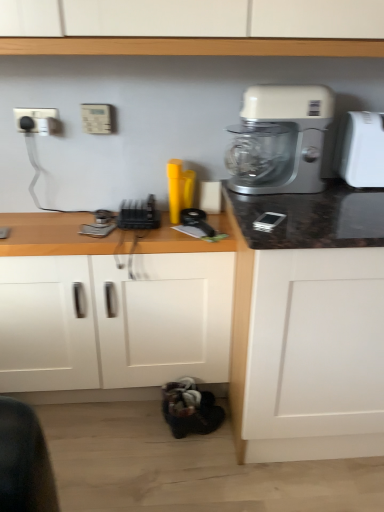
What is the approximate height of black plastic toaster at center?

1.46 inches.

What do you see at coordinates (37, 120) in the screenshot?
I see `white plastic electric outlet at upper left, the 1th electric outlet when ordered from left to right` at bounding box center [37, 120].

What do you see at coordinates (361, 149) in the screenshot? I see `white plastic toaster at right` at bounding box center [361, 149].

Find the location of a particular element. The image size is (384, 512). black plastic toaster at center is located at coordinates (139, 214).

Is white plastic mixer at upper right turned away from white plastic electric outlet at upper left, the 1th electric outlet when ordered from left to right?

No, white plastic mixer at upper right is not facing away from white plastic electric outlet at upper left, the 1th electric outlet when ordered from left to right.

Locate an element on the screen. mixer on the right side of white plastic electric outlet at upper left, positioned as the 2th electric outlet in right-to-left order is located at coordinates (280, 140).

Which object is wider, white plastic mixer at upper right or white plastic electric outlet at upper left, positioned as the 2th electric outlet in right-to-left order?

Wider between the two is white plastic mixer at upper right.

Is white plastic mixer at upper right shorter than white plastic electric outlet at upper left, the 1th electric outlet when ordered from left to right?

No.

From a real-world perspective, is wooden at lower left located beneath black plastic toaster at center?

Yes, from a real-world perspective, wooden at lower left is beneath black plastic toaster at center.

Which object is thinner, wooden at lower left or black plastic toaster at center?

black plastic toaster at center is thinner.

Is wooden at lower left not close to black plastic toaster at center?

Actually, wooden at lower left and black plastic toaster at center are a little close together.

Between wooden at lower left and black plastic toaster at center, which one appears on the right side from the viewer's perspective?

black plastic toaster at center.

Between beige plastic electric outlet at upper center, which is counted as the second electric outlet, starting from the left, and white plastic electric outlet at upper left, the 1th electric outlet when ordered from left to right, which one has less height?

white plastic electric outlet at upper left, the 1th electric outlet when ordered from left to right.

Considering the sizes of objects beige plastic electric outlet at upper center, the first electric outlet when ordered from right to left, and white plastic electric outlet at upper left, positioned as the 2th electric outlet in right-to-left order, in the image provided, who is smaller, beige plastic electric outlet at upper center, the first electric outlet when ordered from right to left, or white plastic electric outlet at upper left, positioned as the 2th electric outlet in right-to-left order,?

Smaller between the two is white plastic electric outlet at upper left, positioned as the 2th electric outlet in right-to-left order.

Considering their positions, is beige plastic electric outlet at upper center, the first electric outlet when ordered from right to left, located in front of or behind white plastic electric outlet at upper left, positioned as the 2th electric outlet in right-to-left order?

In the image, beige plastic electric outlet at upper center, the first electric outlet when ordered from right to left, appears in front of white plastic electric outlet at upper left, positioned as the 2th electric outlet in right-to-left order.

How many degrees apart are the facing directions of beige plastic electric outlet at upper center, which is counted as the second electric outlet, starting from the left, and white plastic electric outlet at upper left, positioned as the 2th electric outlet in right-to-left order?

They differ by 2.73 degrees in their facing directions.

Is white plastic toaster at right aimed at white plastic mixer at upper right?

No.

Where is `toaster that appears behind the white plastic mixer at upper right`? The height and width of the screenshot is (512, 384). toaster that appears behind the white plastic mixer at upper right is located at coordinates (361, 149).

From a real-world perspective, is white plastic toaster at right above or below white plastic mixer at upper right?

From a real-world perspective, white plastic toaster at right is physically below white plastic mixer at upper right.

How many degrees apart are the facing directions of beige plastic electric outlet at upper center, which is counted as the second electric outlet, starting from the left, and black plastic toaster at center?

They differ by 1.11 degrees in their facing directions.

Is black plastic toaster at center at the back of beige plastic electric outlet at upper center, which is counted as the second electric outlet, starting from the left?

No, beige plastic electric outlet at upper center, which is counted as the second electric outlet, starting from the left, is not facing away from black plastic toaster at center.

Where is `appliance in front of the beige plastic electric outlet at upper center, the first electric outlet when ordered from right to left`? Image resolution: width=384 pixels, height=512 pixels. appliance in front of the beige plastic electric outlet at upper center, the first electric outlet when ordered from right to left is located at coordinates (139, 214).

Is black plastic toaster at center located within beige plastic electric outlet at upper center, the first electric outlet when ordered from right to left?

No, black plastic toaster at center is not a part of beige plastic electric outlet at upper center, the first electric outlet when ordered from right to left.

Considering the positions of objects white plastic toaster at right and white plastic electric outlet at upper left, the 1th electric outlet when ordered from left to right, in the image provided, who is behind, white plastic toaster at right or white plastic electric outlet at upper left, the 1th electric outlet when ordered from left to right,?

white plastic electric outlet at upper left, the 1th electric outlet when ordered from left to right, is further from the camera.

Where is `toaster in front of the white plastic electric outlet at upper left, the 1th electric outlet when ordered from left to right`? The width and height of the screenshot is (384, 512). toaster in front of the white plastic electric outlet at upper left, the 1th electric outlet when ordered from left to right is located at coordinates (361, 149).

Is white plastic toaster at right not inside white plastic electric outlet at upper left, positioned as the 2th electric outlet in right-to-left order?

white plastic toaster at right is positioned outside white plastic electric outlet at upper left, positioned as the 2th electric outlet in right-to-left order.

In the scene shown: Is white plastic mixer at upper right positioned beyond the bounds of beige plastic electric outlet at upper center, which is counted as the second electric outlet, starting from the left?

That's correct, white plastic mixer at upper right is outside of beige plastic electric outlet at upper center, which is counted as the second electric outlet, starting from the left.

Is beige plastic electric outlet at upper center, which is counted as the second electric outlet, starting from the left, at the back of white plastic mixer at upper right?

No, beige plastic electric outlet at upper center, which is counted as the second electric outlet, starting from the left, is not at the back of white plastic mixer at upper right.

Considering the sizes of objects white plastic mixer at upper right and beige plastic electric outlet at upper center, which is counted as the second electric outlet, starting from the left, in the image provided, who is bigger, white plastic mixer at upper right or beige plastic electric outlet at upper center, which is counted as the second electric outlet, starting from the left,?

white plastic mixer at upper right.

From the image's perspective, would you say white plastic mixer at upper right is shown under beige plastic electric outlet at upper center, the first electric outlet when ordered from right to left?

Yes.

This screenshot has height=512, width=384. I want to click on the 2nd electric outlet above when counting from the white plastic mixer at upper right (from the image's perspective), so coord(37,120).

I want to click on counter in front of the black plastic toaster at center, so click(x=116, y=320).

Estimate the real-world distances between objects in this image. Which object is closer to white plastic mixer at upper right, white plastic electric outlet at upper left, the 1th electric outlet when ordered from left to right, or wooden at lower left?

wooden at lower left lies closer to white plastic mixer at upper right than the other object.

Estimate the real-world distances between objects in this image. Which object is closer to wooden at lower left, white plastic mixer at upper right or black plastic toaster at center?

black plastic toaster at center lies closer to wooden at lower left than the other object.

When comparing their distances from white plastic electric outlet at upper left, the 1th electric outlet when ordered from left to right, does black plastic toaster at center or white plastic mixer at upper right seem further?

white plastic mixer at upper right lies further to white plastic electric outlet at upper left, the 1th electric outlet when ordered from left to right, than the other object.

Which object lies further to the anchor point wooden at lower left, white plastic mixer at upper right or white plastic toaster at right?

white plastic toaster at right is further to wooden at lower left.

Looking at the image, which one is located further to white plastic toaster at right, black plastic toaster at center or white plastic electric outlet at upper left, positioned as the 2th electric outlet in right-to-left order?

white plastic electric outlet at upper left, positioned as the 2th electric outlet in right-to-left order, is further to white plastic toaster at right.

Based on their spatial positions, is white plastic mixer at upper right or white plastic toaster at right further from black plastic toaster at center?

white plastic toaster at right is positioned further to the anchor black plastic toaster at center.

Looking at the image, which one is located further to black plastic toaster at center, white plastic electric outlet at upper left, positioned as the 2th electric outlet in right-to-left order, or white plastic toaster at right?

white plastic toaster at right lies further to black plastic toaster at center than the other object.

When comparing their distances from white plastic electric outlet at upper left, positioned as the 2th electric outlet in right-to-left order, does white plastic mixer at upper right or white plastic toaster at right seem further?

Among the two, white plastic toaster at right is located further to white plastic electric outlet at upper left, positioned as the 2th electric outlet in right-to-left order.

I want to click on appliance between white plastic electric outlet at upper left, the 1th electric outlet when ordered from left to right, and wooden at lower left from top to bottom, so click(x=139, y=214).

You are a GUI agent. You are given a task and a screenshot of the screen. Output one action in this format:
    pyautogui.click(x=<x>, y=<y>)
    Task: Click on the mixer between beige plastic electric outlet at upper center, the first electric outlet when ordered from right to left, and white plastic toaster at right from left to right
    Image resolution: width=384 pixels, height=512 pixels.
    Given the screenshot: What is the action you would take?
    pyautogui.click(x=280, y=140)

At what (x,y) coordinates should I click in order to perform the action: click on appliance between white plastic electric outlet at upper left, positioned as the 2th electric outlet in right-to-left order, and white plastic mixer at upper right from left to right. Please return your answer as a coordinate pair (x, y). The height and width of the screenshot is (512, 384). Looking at the image, I should click on (139, 214).

The width and height of the screenshot is (384, 512). I want to click on mixer located between white plastic electric outlet at upper left, positioned as the 2th electric outlet in right-to-left order, and white plastic toaster at right in the left-right direction, so click(x=280, y=140).